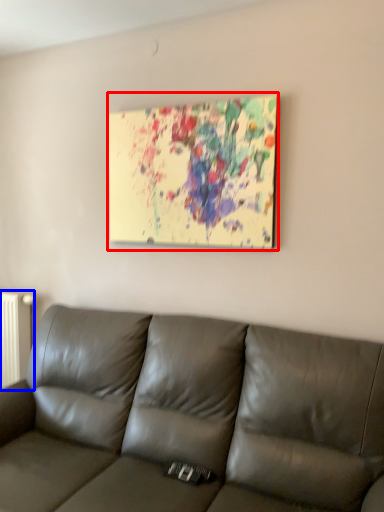
Question: Among these objects, which one is farthest to the camera, picture frame (highlighted by a red box) or radiator (highlighted by a blue box)?

Choices:
 (A) picture frame
 (B) radiator

Answer: (B)